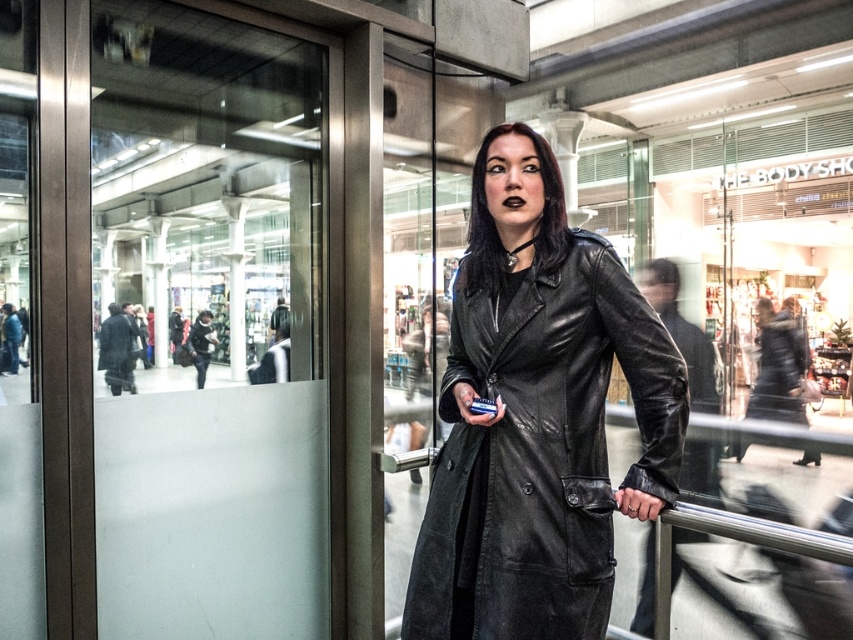
Which is behind, point (274, 205) or point (459, 561)?

Positioned behind is point (274, 205).

Does transparent frosted glass at left come in front of matte black coat at center?

That is False.

The height and width of the screenshot is (640, 853). I want to click on transparent frosted glass at left, so click(210, 324).

Is matte black coat at center to the right of leather coat at center from the viewer's perspective?

Incorrect, matte black coat at center is not on the right side of leather coat at center.

Does matte black coat at center appear over leather coat at center?

Yes, matte black coat at center is above leather coat at center.

Locate an element on the screen. Image resolution: width=853 pixels, height=640 pixels. matte black coat at center is located at coordinates (537, 417).

Is transparent frosted glass at left above leather coat at center?

Indeed, transparent frosted glass at left is positioned over leather coat at center.

In the scene shown: Does transparent frosted glass at left have a lesser width compared to leather coat at center?

Answer: No.

I want to click on transparent frosted glass at left, so click(210, 324).

This screenshot has height=640, width=853. Find the location of `transparent frosted glass at left`. transparent frosted glass at left is located at coordinates (210, 324).